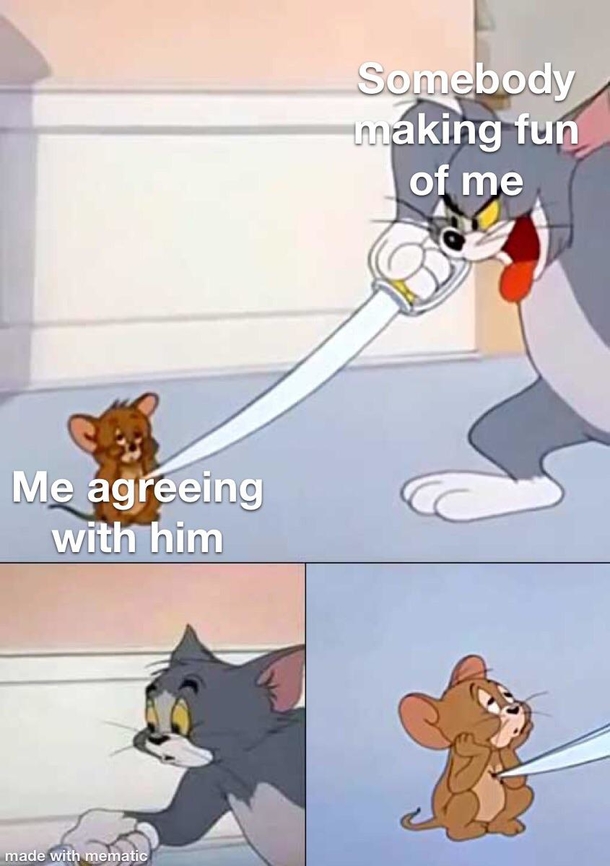
Locate an element on the screen. Image resolution: width=610 pixels, height=866 pixels. floor is located at coordinates (398, 487), (392, 785).